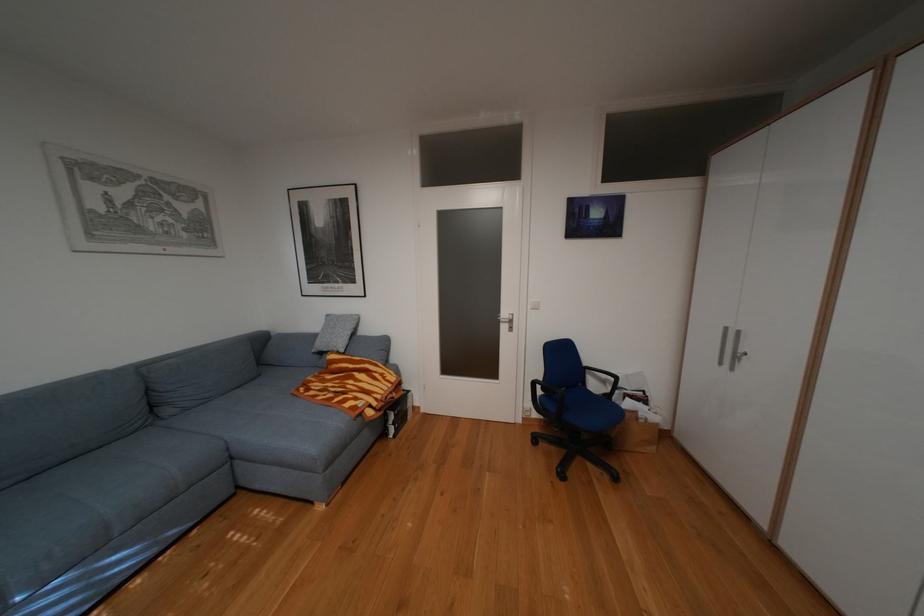
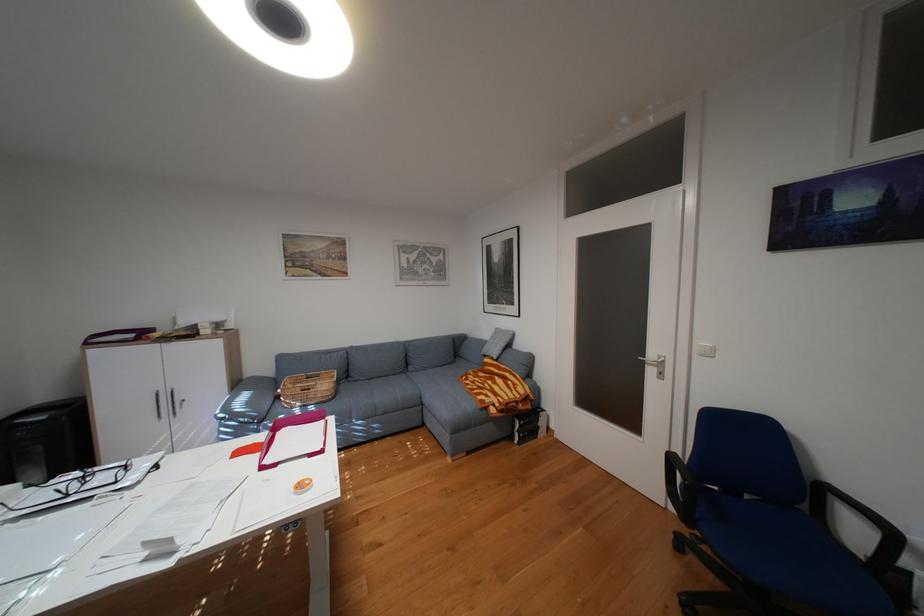
The point at (x=399, y=434) is marked in the first image. Where is the corresponding point in the second image?

(526, 438)